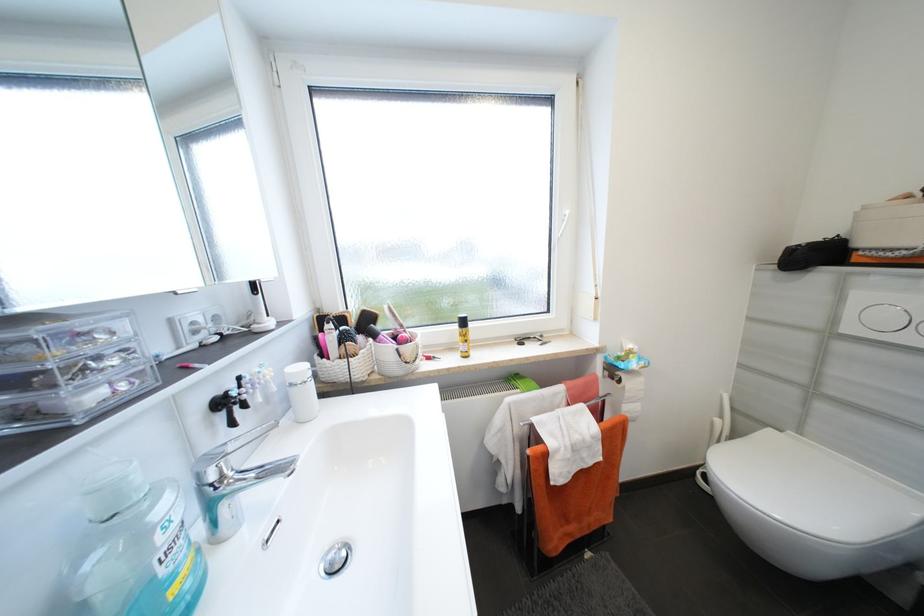
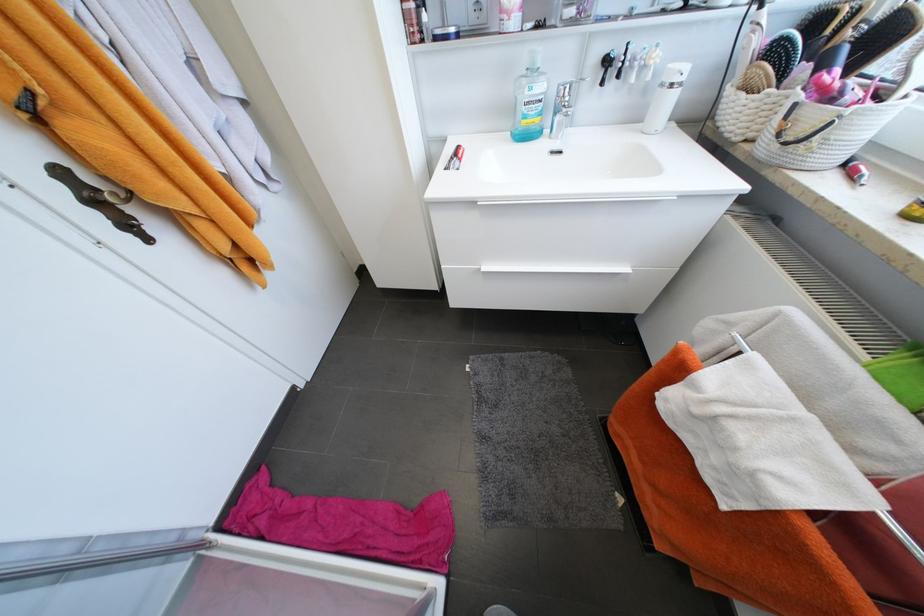
Find the pixel in the second image that matches (x=226, y=405) in the first image.

(613, 62)